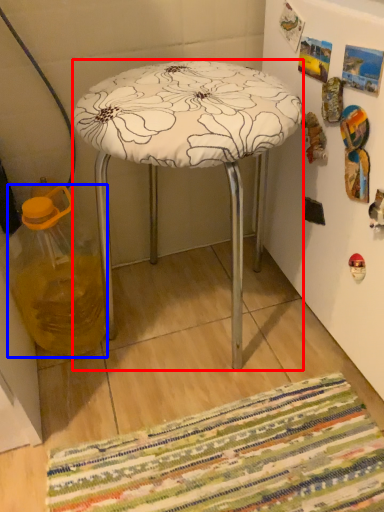
Question: Which object is closer to the camera taking this photo, stool (highlighted by a red box) or glass jar (highlighted by a blue box)?

Choices:
 (A) stool
 (B) glass jar

Answer: (A)